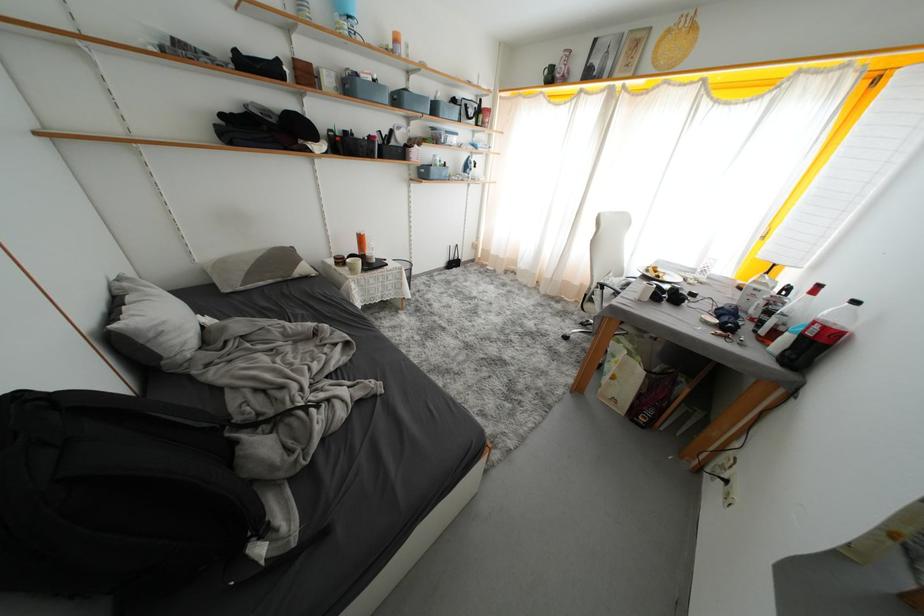
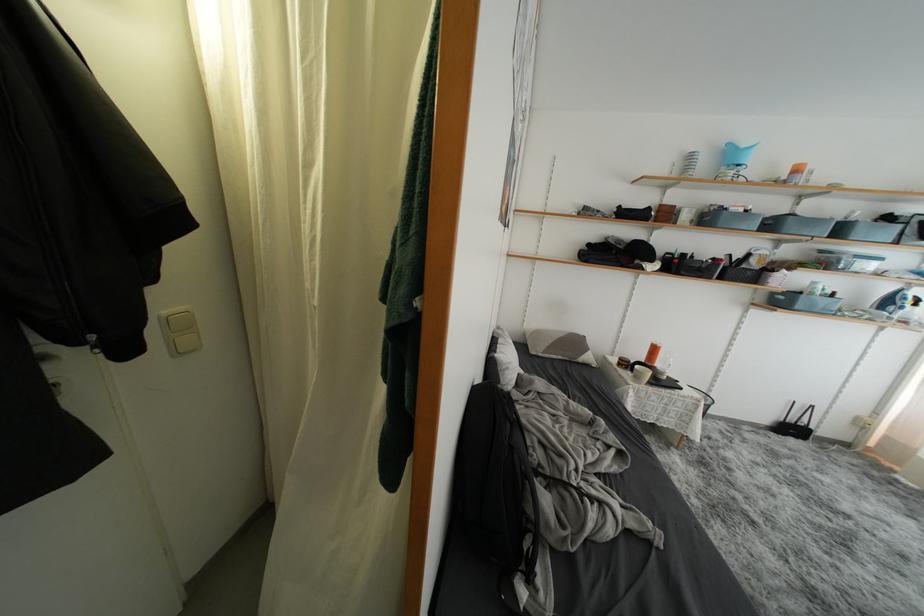
Find the pixel in the second image that matches point (339, 79) in the first image.

(700, 215)